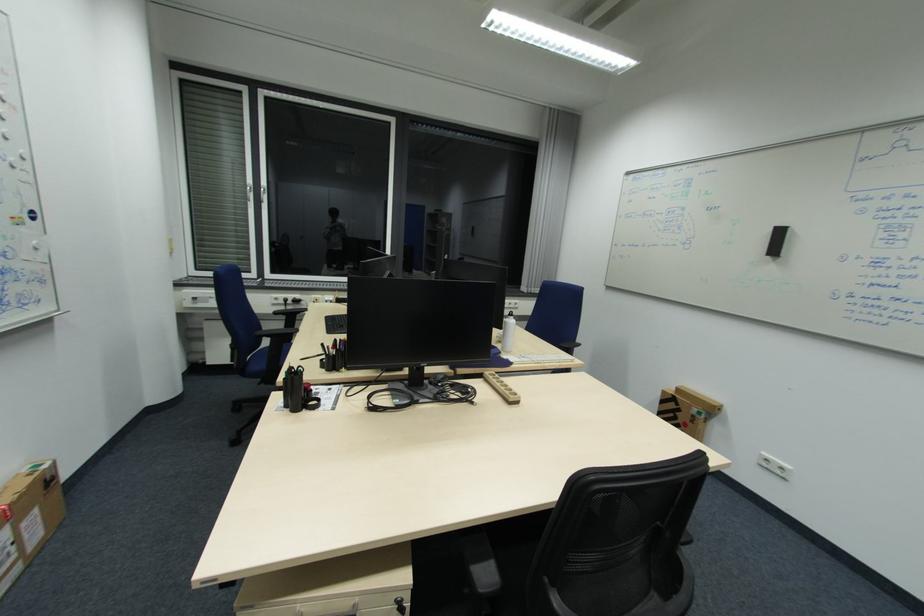
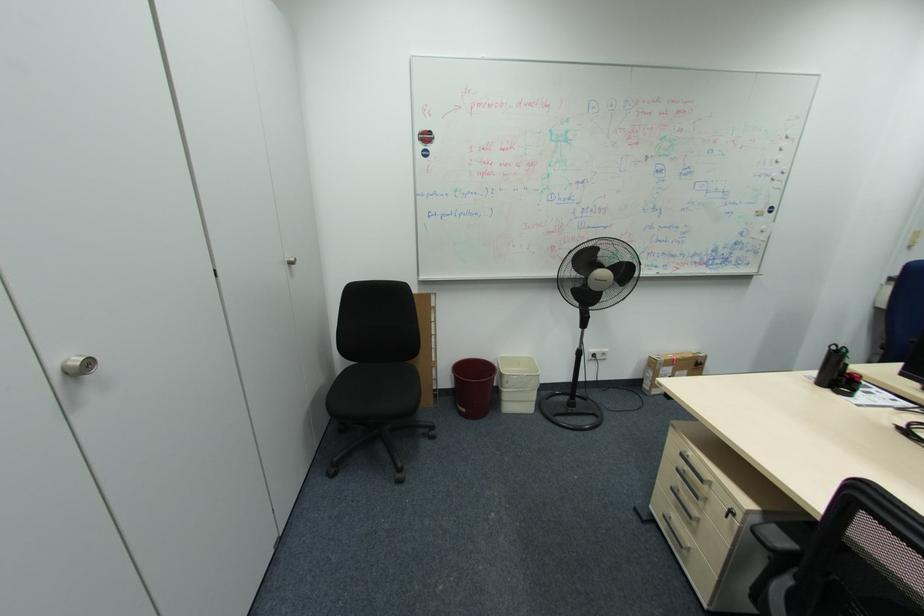
Based on the continuous images, in which direction is the camera rotating?

The rotation direction of the camera is left-down.